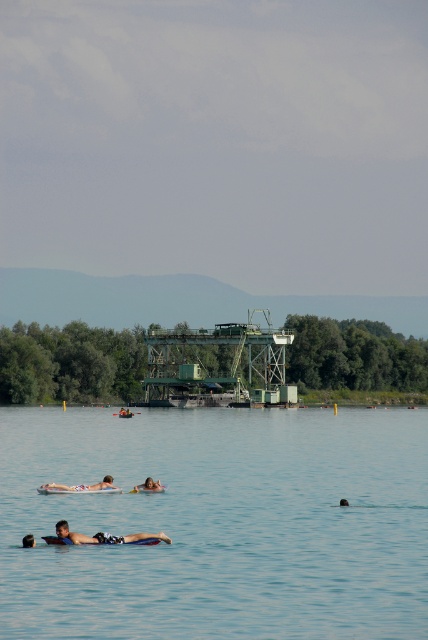
Is smooth tan skin at center thinner than smooth orange kayak at center?

Correct, smooth tan skin at center's width is less than smooth orange kayak at center's.

At what (x,y) coordinates should I click in order to perform the action: click on smooth tan skin at center. Please return your answer as a coordinate pair (x, y). This screenshot has width=428, height=640. Looking at the image, I should click on (149, 484).

At what (x,y) coordinates should I click in order to perform the action: click on smooth tan skin at center. Please return your answer as a coordinate pair (x, y). This screenshot has height=640, width=428. Looking at the image, I should click on (149, 484).

Describe the element at coordinates (217, 524) in the screenshot. The height and width of the screenshot is (640, 428). I see `clear blue water at center` at that location.

Between clear blue water at center and smooth orange kayak at center, which one has more height?

clear blue water at center is taller.

The image size is (428, 640). What do you see at coordinates (217, 524) in the screenshot?
I see `clear blue water at center` at bounding box center [217, 524].

Find the location of a particular element. clear blue water at center is located at coordinates (217, 524).

Who is positioned more to the left, smooth skin person at lower center or dark brown hair at lower center?

smooth skin person at lower center is more to the left.

Identify the location of smooth skin person at lower center. The height and width of the screenshot is (640, 428). (29, 540).